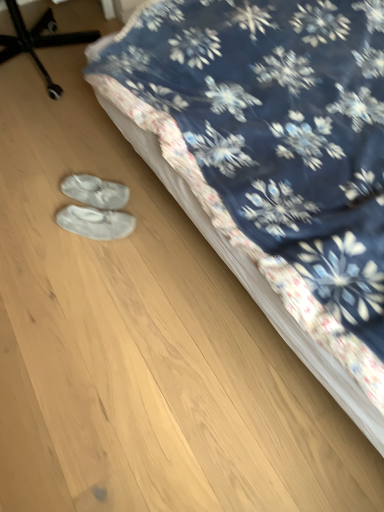
The height and width of the screenshot is (512, 384). Find the location of `unoccupied region to the right of white suede slippers at lower center, the first footwear from the bottom`. unoccupied region to the right of white suede slippers at lower center, the first footwear from the bottom is located at coordinates [x=154, y=223].